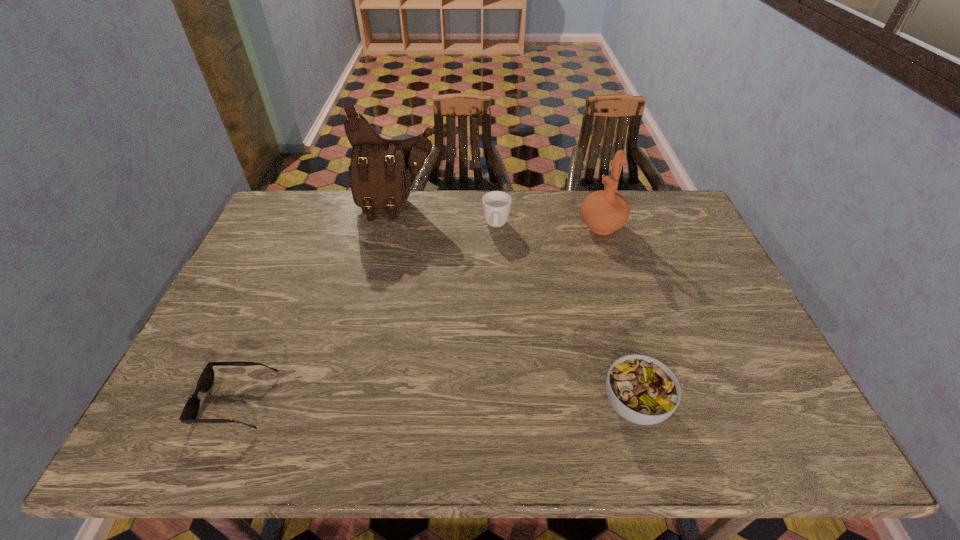
Find the location of a particular element. Image resolution: width=960 pixels, height=540 pixels. free region located with the handle on the side of the cup is located at coordinates (495, 273).

The image size is (960, 540). Find the location of `free spot located 0.280m with the handle on the side of the cup`. free spot located 0.280m with the handle on the side of the cup is located at coordinates (494, 303).

This screenshot has height=540, width=960. I want to click on free region located on the spout of the pottery, so click(569, 264).

At what (x,y) coordinates should I click in order to perform the action: click on vacant space located on the spout of the pottery. Please return your answer as a coordinate pair (x, y). The height and width of the screenshot is (540, 960). Looking at the image, I should click on coord(561,274).

The width and height of the screenshot is (960, 540). I want to click on free region located on the spout of the pottery, so click(554, 282).

Identify the location of vacant space situated 0.180m on the front-facing side of the shoulder bag. The image size is (960, 540). (396, 258).

Locate an element on the screen. blank area located 0.320m on the front-facing side of the shoulder bag is located at coordinates (396, 290).

Where is `free space located 0.210m on the front-facing side of the shoulder bag`? The width and height of the screenshot is (960, 540). free space located 0.210m on the front-facing side of the shoulder bag is located at coordinates (396, 264).

The width and height of the screenshot is (960, 540). Identify the location of cup present at the far edge. (496, 205).

Where is `pottery that is at the far edge`? pottery that is at the far edge is located at coordinates (605, 211).